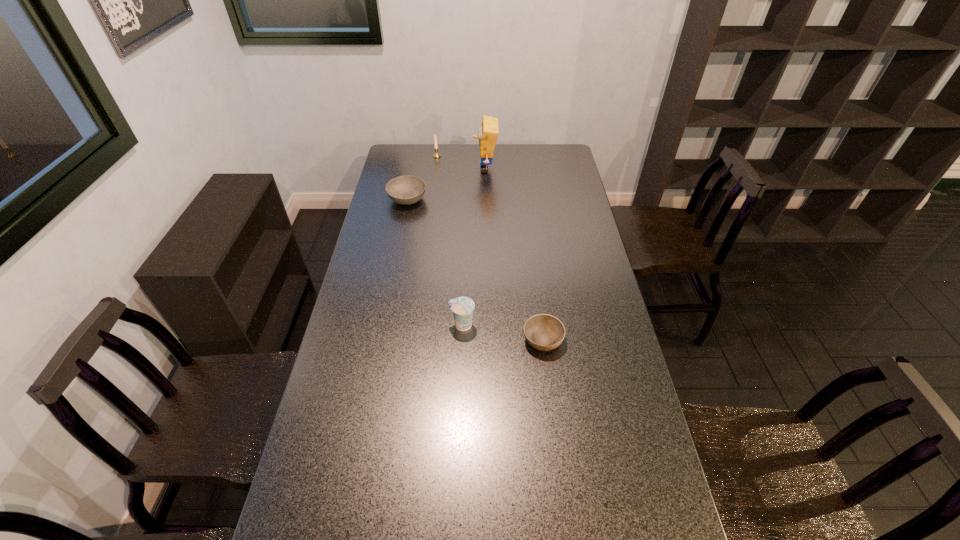
The height and width of the screenshot is (540, 960). What are the coordinates of `vacant space located on the front of the fourth shortest object` in the screenshot? It's located at (430, 204).

You are a GUI agent. You are given a task and a screenshot of the screen. Output one action in this format:
    pyautogui.click(x=<x>, y=<y>)
    Task: Click on the vacant space positioned on the right of the third shortest object
    The width and height of the screenshot is (960, 540).
    Given the screenshot: What is the action you would take?
    pyautogui.click(x=577, y=325)

The height and width of the screenshot is (540, 960). In order to click on free spot located on the front of the fourth tallest object in this screenshot , I will do `click(392, 276)`.

Locate an element on the screen. free space located 0.070m on the left of the shortest object is located at coordinates (501, 340).

The image size is (960, 540). In order to click on sponge positioned at the far edge in this screenshot , I will do `click(488, 132)`.

Locate an element on the screen. candle holder that is at the far edge is located at coordinates (436, 155).

In order to click on object situated at the left edge in this screenshot , I will do `click(406, 190)`.

You are a GUI agent. You are given a task and a screenshot of the screen. Output one action in this format:
    pyautogui.click(x=<x>, y=<y>)
    Task: Click on the free location at the far edge
    This screenshot has height=540, width=960.
    Given the screenshot: What is the action you would take?
    [460, 164]

Where is `free space at the left edge`? free space at the left edge is located at coordinates (294, 504).

Locate an element on the screen. The image size is (960, 540). free space at the right edge is located at coordinates (557, 227).